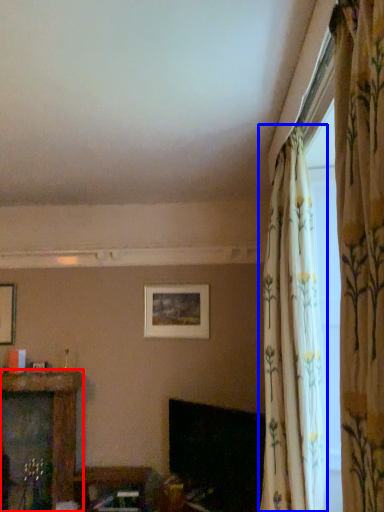
Question: Which object is closer to the camera taking this photo, furniture (highlighted by a red box) or curtain (highlighted by a blue box)?

Choices:
 (A) furniture
 (B) curtain

Answer: (B)